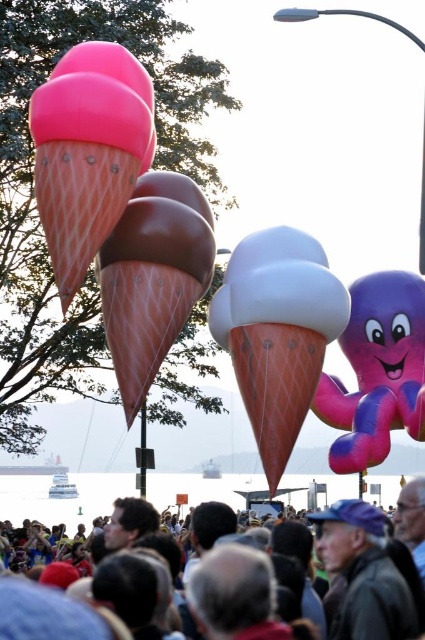
Is pink matte ice cream cone at upper left below dark gray fabric crowd at lower center?

No.

The image size is (425, 640). What do you see at coordinates (305, 205) in the screenshot?
I see `pink matte ice cream cone at upper left` at bounding box center [305, 205].

Locate an element on the screen. pink matte ice cream cone at upper left is located at coordinates (305, 205).

Who is lower down, white matte ice cream cone at center or pink rubber ice cream cone at left?

white matte ice cream cone at center

Who is positioned more to the left, white matte ice cream cone at center or pink rubber ice cream cone at left?

From the viewer's perspective, pink rubber ice cream cone at left appears more on the left side.

Is point (294, 236) farther from camera compared to point (144, 150)?

Yes, point (294, 236) is farther from viewer.

Where is `white matte ice cream cone at center`? This screenshot has width=425, height=640. white matte ice cream cone at center is located at coordinates (277, 332).

Can you confirm if pink rubber ice cream cone at left is smaller than purple glossy octopus at right?

Correct, pink rubber ice cream cone at left occupies less space than purple glossy octopus at right.

Is pink rubber ice cream cone at left in front of purple glossy octopus at right?

Yes, pink rubber ice cream cone at left is closer to the viewer.

Measure the distance between point (73, 150) and camera.

The distance of point (73, 150) from camera is 299.97 feet.

Identify the location of pink rubber ice cream cone at left. (85, 163).